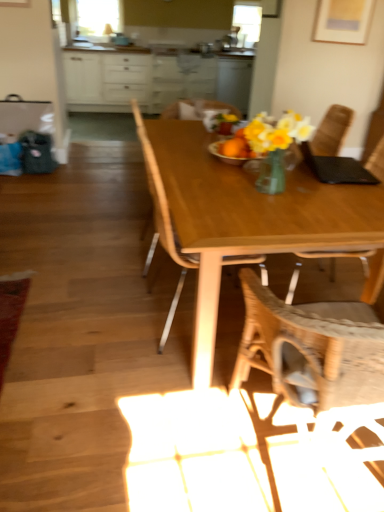
Question: From a real-world perspective, is clear glass window screen at upper left physically below white glossy cabinets at upper center?

Choices:
 (A) no
 (B) yes

Answer: (A)

Question: Can you see clear glass window screen at upper left touching white glossy cabinets at upper center?

Choices:
 (A) no
 (B) yes

Answer: (A)

Question: Is white glossy cabinets at upper center at the back of clear glass window screen at upper left?

Choices:
 (A) no
 (B) yes

Answer: (A)

Question: From a real-world perspective, is clear glass window screen at upper left on top of white glossy cabinets at upper center?

Choices:
 (A) yes
 (B) no

Answer: (A)

Question: From the image's perspective, is clear glass window screen at upper left beneath white glossy cabinets at upper center?

Choices:
 (A) no
 (B) yes

Answer: (A)

Question: Can you confirm if clear glass window screen at upper left is taller than white glossy cabinets at upper center?

Choices:
 (A) no
 (B) yes

Answer: (A)

Question: Would you say white glossy cabinets at upper center is outside woven fabric chair at center, marked as the 2th chair in a right-to-left arrangement?

Choices:
 (A) yes
 (B) no

Answer: (A)

Question: Is white glossy cabinets at upper center oriented towards woven fabric chair at center, marked as the 2th chair in a right-to-left arrangement?

Choices:
 (A) yes
 (B) no

Answer: (A)

Question: From the image's perspective, is white glossy cabinets at upper center beneath woven fabric chair at center, marked as the 2th chair in a right-to-left arrangement?

Choices:
 (A) yes
 (B) no

Answer: (B)

Question: Can you confirm if white glossy cabinets at upper center is wider than woven fabric chair at center, acting as the 2th chair starting from the left?

Choices:
 (A) yes
 (B) no

Answer: (A)

Question: Can you confirm if white glossy cabinets at upper center is positioned to the right of woven fabric chair at center, acting as the 2th chair starting from the left?

Choices:
 (A) no
 (B) yes

Answer: (A)

Question: Does white glossy cabinets at upper center have a larger size compared to woven fabric chair at center, acting as the 2th chair starting from the left?

Choices:
 (A) yes
 (B) no

Answer: (A)

Question: Does woven fabric chair at center, marked as the 2th chair in a right-to-left arrangement, lie in front of wooden chair at center, the first chair positioned from the left?

Choices:
 (A) yes
 (B) no

Answer: (A)